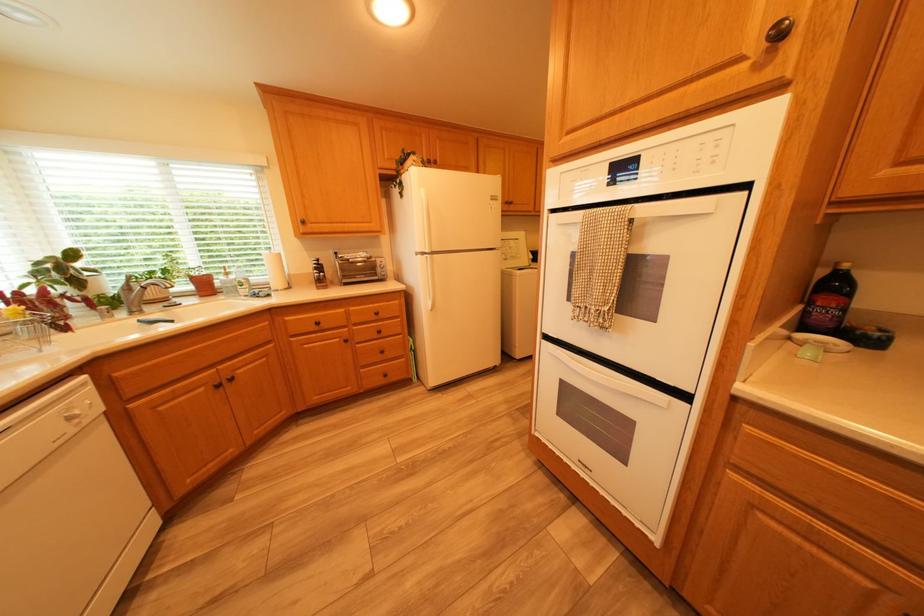
The height and width of the screenshot is (616, 924). Find the location of `white refrigerator handle`. white refrigerator handle is located at coordinates (426, 246).